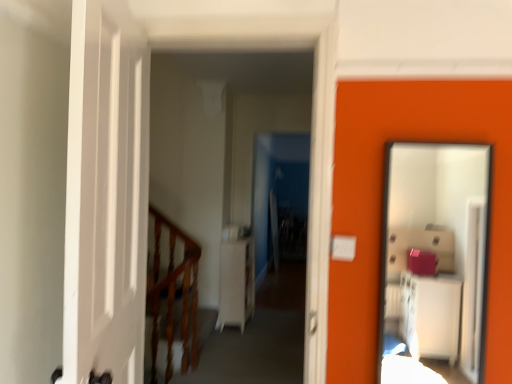
Question: Can you confirm if white glossy cabinet at center is positioned to the right of smooth glass mirror at right?

Choices:
 (A) no
 (B) yes

Answer: (A)

Question: Does white glossy cabinet at center have a greater width compared to smooth glass mirror at right?

Choices:
 (A) no
 (B) yes

Answer: (B)

Question: From the image's perspective, would you say white glossy cabinet at center is shown under smooth glass mirror at right?

Choices:
 (A) yes
 (B) no

Answer: (B)

Question: Could smooth glass mirror at right be considered to be inside white glossy cabinet at center?

Choices:
 (A) yes
 (B) no

Answer: (B)

Question: Is white glossy cabinet at center located outside smooth glass mirror at right?

Choices:
 (A) yes
 (B) no

Answer: (A)

Question: From a real-world perspective, is white matte dresser at center physically located above or below white glossy cabinet at center?

Choices:
 (A) below
 (B) above

Answer: (A)

Question: Is white matte dresser at center to the left or to the right of white glossy cabinet at center in the image?

Choices:
 (A) left
 (B) right

Answer: (A)

Question: Is point (245, 256) positioned closer to the camera than point (305, 115)?

Choices:
 (A) closer
 (B) farther

Answer: (A)

Question: From the image's perspective, is white matte dresser at center located above or below white glossy cabinet at center?

Choices:
 (A) above
 (B) below

Answer: (B)

Question: Choose the correct answer: Is white glossy cabinet at center inside wooden at left or outside it?

Choices:
 (A) inside
 (B) outside

Answer: (B)

Question: From their relative heights in the image, would you say white glossy cabinet at center is taller or shorter than wooden at left?

Choices:
 (A) short
 (B) tall

Answer: (B)

Question: From the image's perspective, is white glossy cabinet at center above or below wooden at left?

Choices:
 (A) above
 (B) below

Answer: (A)

Question: Considering the positions of point (201, 271) and point (190, 251), is point (201, 271) closer or farther from the camera than point (190, 251)?

Choices:
 (A) farther
 (B) closer

Answer: (A)

Question: Considering the positions of point (401, 206) and point (227, 286), is point (401, 206) closer or farther from the camera than point (227, 286)?

Choices:
 (A) closer
 (B) farther

Answer: (B)

Question: From a real-world perspective, is smooth glass mirror at right positioned above or below white matte dresser at center?

Choices:
 (A) above
 (B) below

Answer: (A)